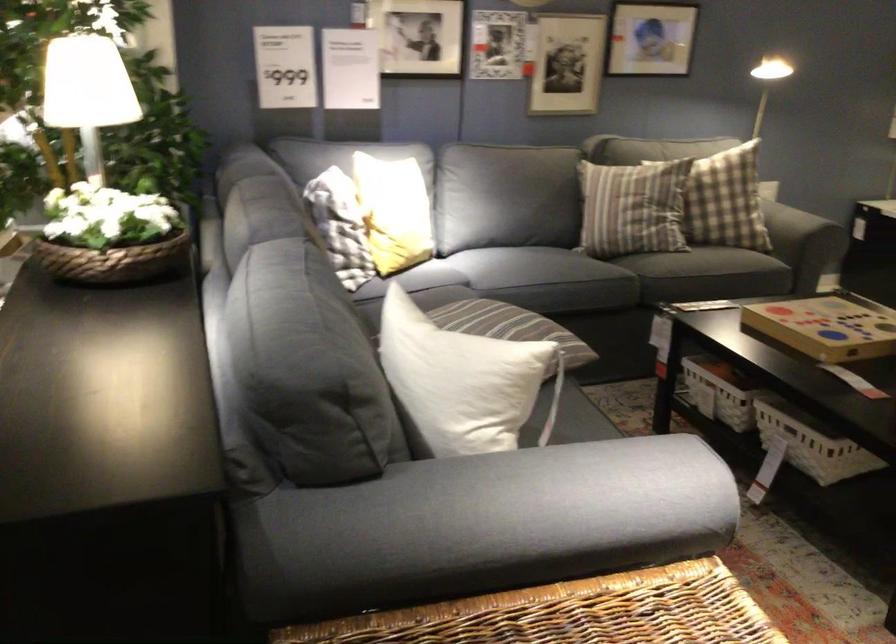
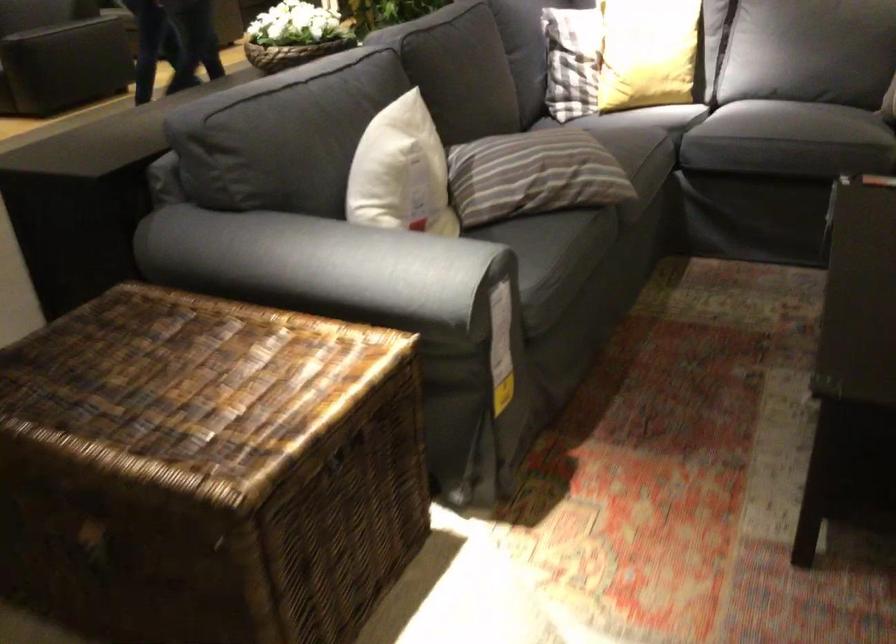
In the second image, find the point that corresponds to (x=583, y=272) in the first image.

(768, 122)